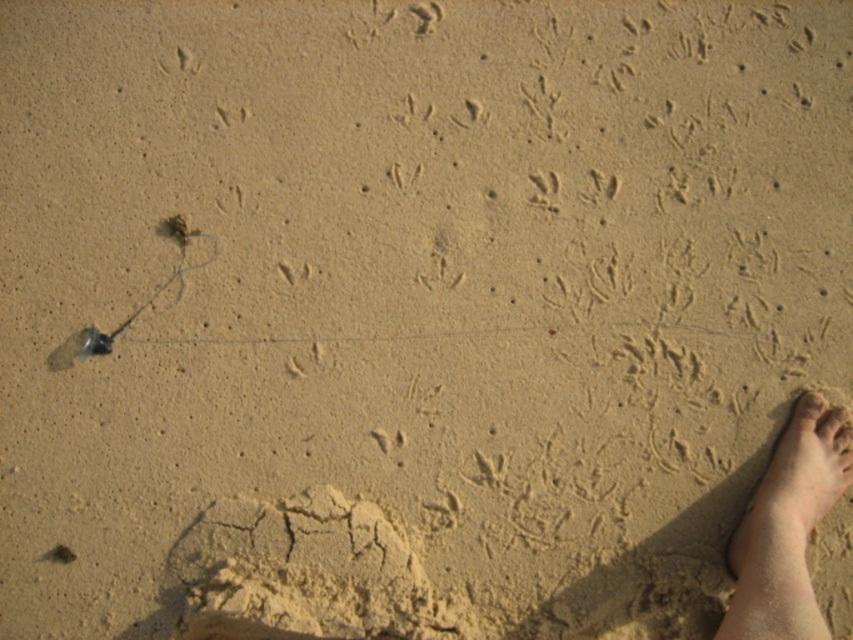
Based on the photo, you are a lifeguard observing the beach scene. You notice a light skin textured foot at lower right and a smooth skin toe at lower right. Which object has a greater width?

The light skin textured foot at lower right has a greater width than the smooth skin toe at lower right.

You are standing on the beach and see two points marked on the sand. One is at coordinates point (759, 536) and the other at point (817, 392). Which point is closer to you?

Point (759, 536) is closer to the viewer than point (817, 392).

From the picture: You are standing on the beach and notice two parts of your foot visible in the sand. Which part is closer to you, the light skin textured foot at lower right or the smooth skin toe at lower right?

The light skin textured foot at lower right is closer to the viewer than the smooth skin toe at lower right.